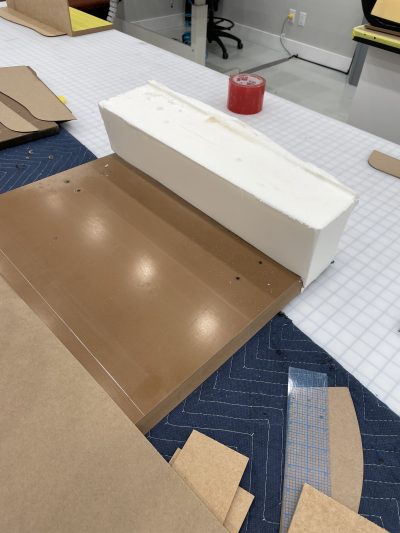
Find the location of a particular element. office chair is located at coordinates (220, 29).